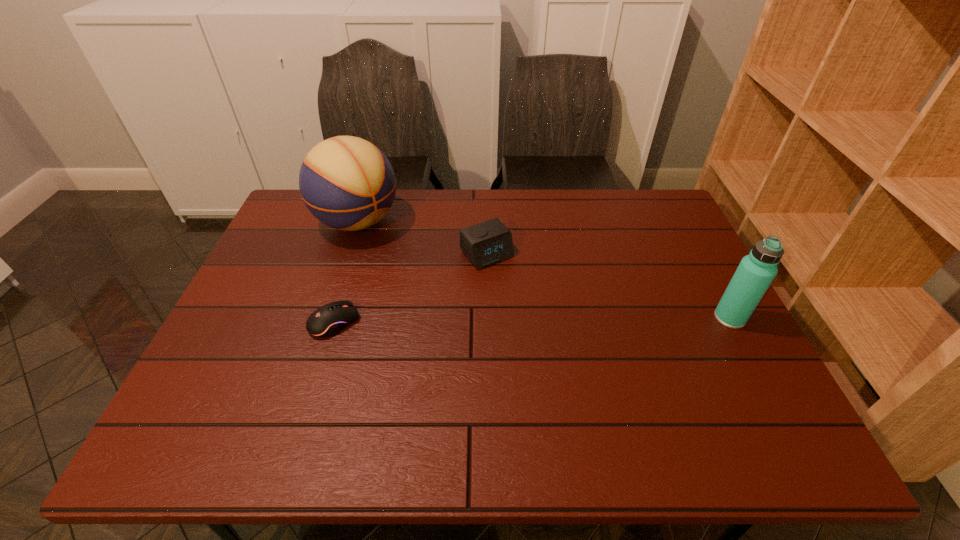
Where is `vacant area between the basketball and the shortest object`? vacant area between the basketball and the shortest object is located at coordinates (347, 272).

The height and width of the screenshot is (540, 960). In order to click on vacant space that is in between the basketball and the computer mouse in this screenshot , I will do `click(347, 272)`.

Where is `object identified as the second closest to the third object from left to right`? The image size is (960, 540). object identified as the second closest to the third object from left to right is located at coordinates (328, 320).

You are a GUI agent. You are given a task and a screenshot of the screen. Output one action in this format:
    pyautogui.click(x=<x>, y=<y>)
    Task: Click on the object identified as the closest to the basketball
    The width and height of the screenshot is (960, 540).
    Given the screenshot: What is the action you would take?
    pyautogui.click(x=486, y=243)

This screenshot has width=960, height=540. In order to click on vacant space that satisfies the following two spatial constraints: 1. on the back side of the thermos bottle; 2. on the right side of the computer mouse in this screenshot , I will do `click(336, 318)`.

Where is `vacant space that satisfies the following two spatial constraints: 1. on the front side of the thermos bottle; 2. on the right side of the alarm clock`? The height and width of the screenshot is (540, 960). vacant space that satisfies the following two spatial constraints: 1. on the front side of the thermos bottle; 2. on the right side of the alarm clock is located at coordinates pyautogui.click(x=489, y=318).

The height and width of the screenshot is (540, 960). In order to click on free location that satisfies the following two spatial constraints: 1. on the front side of the basketball; 2. on the right side of the thermos bottle in this screenshot , I will do `click(326, 318)`.

I want to click on free spot that satisfies the following two spatial constraints: 1. on the front side of the third object from left to right; 2. on the left side of the basketball, so (x=348, y=254).

Image resolution: width=960 pixels, height=540 pixels. Find the location of `free spot that satisfies the following two spatial constraints: 1. on the front side of the basketball; 2. on the right side of the rightmost object`. free spot that satisfies the following two spatial constraints: 1. on the front side of the basketball; 2. on the right side of the rightmost object is located at coordinates (326, 318).

Identify the location of free spot that satisfies the following two spatial constraints: 1. on the front side of the basketball; 2. on the right side of the shortest object. (324, 322).